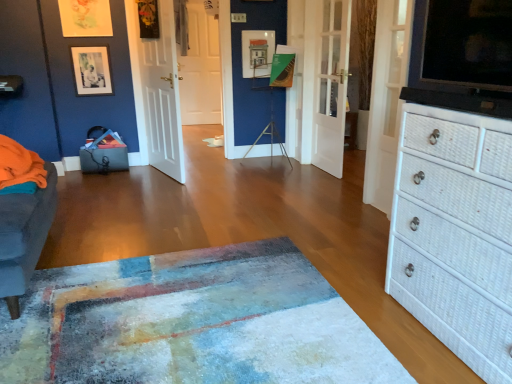
Question: Considering the relative sizes of white wooden door at left, placed as the fourth door when sorted from right to left, and white wicker chest of drawers at right in the image provided, is white wooden door at left, placed as the fourth door when sorted from right to left, shorter than white wicker chest of drawers at right?

Choices:
 (A) no
 (B) yes

Answer: (A)

Question: Could you tell me if white wooden door at left, which appears as the third door when viewed from the back, is turned towards white wicker chest of drawers at right?

Choices:
 (A) yes
 (B) no

Answer: (B)

Question: From a real-world perspective, is white wooden door at left, which appears as the third door when viewed from the back, on white wicker chest of drawers at right?

Choices:
 (A) no
 (B) yes

Answer: (B)

Question: Is white wooden door at left, which appears as the third door when viewed from the back, next to white wicker chest of drawers at right?

Choices:
 (A) yes
 (B) no

Answer: (B)

Question: Can we say white wooden door at left, which ranks as the first door in left-to-right order, lies outside white wicker chest of drawers at right?

Choices:
 (A) yes
 (B) no

Answer: (A)

Question: From the image's perspective, does white wooden door at left, arranged as the 2th door when viewed from the front, appear higher than white wicker chest of drawers at right?

Choices:
 (A) no
 (B) yes

Answer: (B)

Question: Is white wicker chest of drawers at right beside white wooden door at left, arranged as the 2th door when viewed from the front?

Choices:
 (A) no
 (B) yes

Answer: (A)

Question: From the image's perspective, is white wicker chest of drawers at right over white wooden door at left, which ranks as the first door in left-to-right order?

Choices:
 (A) no
 (B) yes

Answer: (A)

Question: Is white wicker chest of drawers at right smaller than white wooden door at left, which appears as the third door when viewed from the back?

Choices:
 (A) no
 (B) yes

Answer: (A)

Question: Is white wicker chest of drawers at right oriented away from white wooden door at left, which appears as the third door when viewed from the back?

Choices:
 (A) no
 (B) yes

Answer: (A)

Question: From a real-world perspective, is white wicker chest of drawers at right physically above white wooden door at left, arranged as the 2th door when viewed from the front?

Choices:
 (A) no
 (B) yes

Answer: (A)

Question: Can you confirm if white wicker chest of drawers at right is taller than white wooden door at left, which ranks as the first door in left-to-right order?

Choices:
 (A) yes
 (B) no

Answer: (B)

Question: From the image's perspective, is white glossy door at center, placed as the third door when sorted from front to back, above white wooden door at left, placed as the fourth door when sorted from right to left?

Choices:
 (A) no
 (B) yes

Answer: (B)